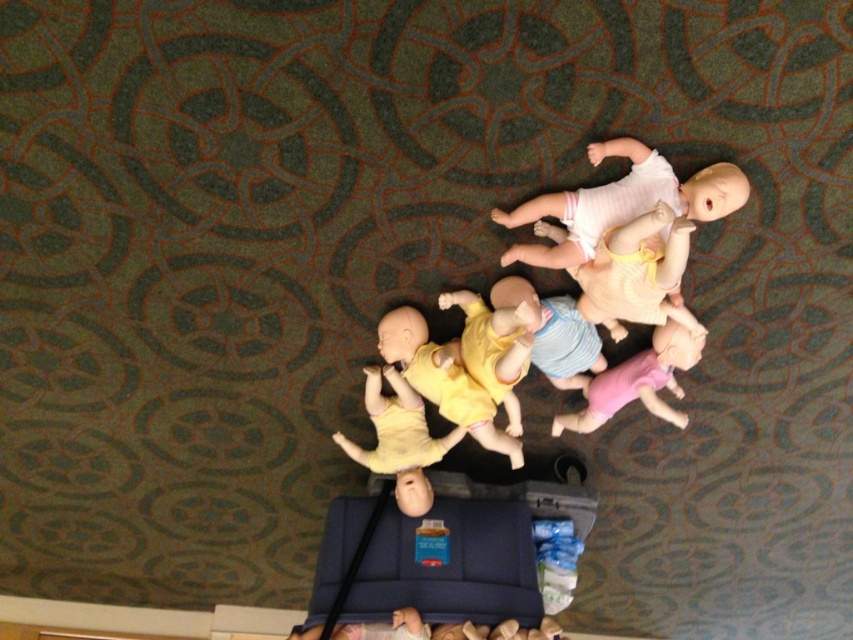
Question: Is matte yellow doll at center above yellow matte baby doll at center?

Choices:
 (A) yes
 (B) no

Answer: (B)

Question: From the image, what is the correct spatial relationship of matte yellow doll at center in relation to yellow matte baby doll at center?

Choices:
 (A) below
 (B) above

Answer: (A)

Question: Which object is closer to the camera taking this photo?

Choices:
 (A) light pink fabric baby doll at upper right
 (B) yellow matte baby doll at center
 (C) matte yellow doll at center
 (D) white matte baby doll at upper right

Answer: (A)

Question: Where is white matte baby doll at upper right located in relation to matte yellow doll at center in the image?

Choices:
 (A) above
 (B) below

Answer: (A)

Question: Which object appears closest to the camera in this image?

Choices:
 (A) light pink fabric baby doll at upper right
 (B) yellow matte doll at center

Answer: (A)

Question: Which point appears farthest from the camera in this image?

Choices:
 (A) (515, 448)
 (B) (500, 372)

Answer: (A)